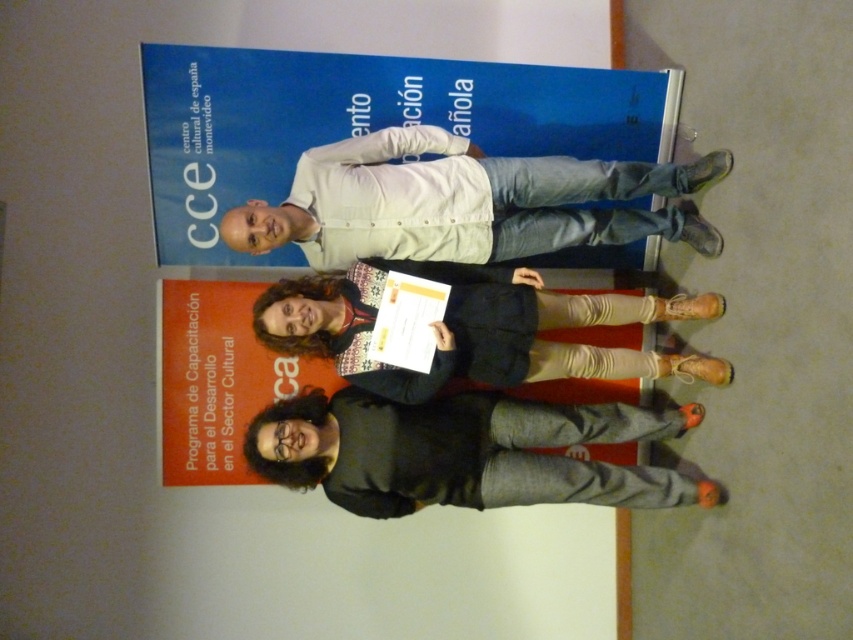
Can you confirm if white matte shirt at upper center is positioned above knitted sweater at center?

Correct, white matte shirt at upper center is located above knitted sweater at center.

Does white matte shirt at upper center have a lesser width compared to knitted sweater at center?

Incorrect, white matte shirt at upper center's width is not less than knitted sweater at center's.

What are the coordinates of `white matte shirt at upper center` in the screenshot? It's located at (x=465, y=202).

Where is `white matte shirt at upper center`? white matte shirt at upper center is located at coordinates (465, 202).

Consider the image. Between white matte shirt at upper center and gray cotton pants at lower center, which one appears on the right side from the viewer's perspective?

gray cotton pants at lower center is more to the right.

Describe the element at coordinates (465, 202) in the screenshot. The width and height of the screenshot is (853, 640). I see `white matte shirt at upper center` at that location.

Who is more forward, (520, 161) or (654, 490)?

Point (520, 161) is in front.

Locate an element on the screen. white matte shirt at upper center is located at coordinates (465, 202).

Between point (474, 420) and point (389, 385), which one is positioned in front?

Point (389, 385) is more forward.

Does point (643, 502) come closer to viewer compared to point (537, 316)?

No, (643, 502) is behind (537, 316).

Locate an element on the screen. The width and height of the screenshot is (853, 640). gray cotton pants at lower center is located at coordinates (463, 452).